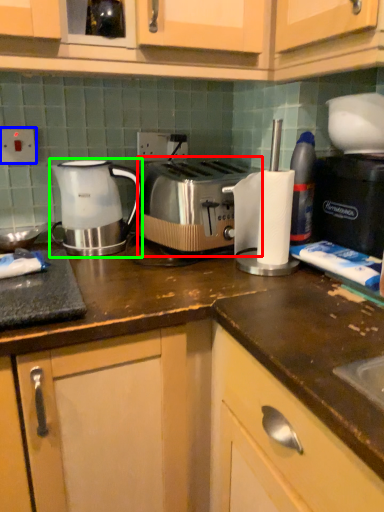
Question: Which object is the closest to the toaster (highlighted by a red box)? Choose among these: electric outlet (highlighted by a blue box) or kettle (highlighted by a green box).

Choices:
 (A) electric outlet
 (B) kettle

Answer: (B)